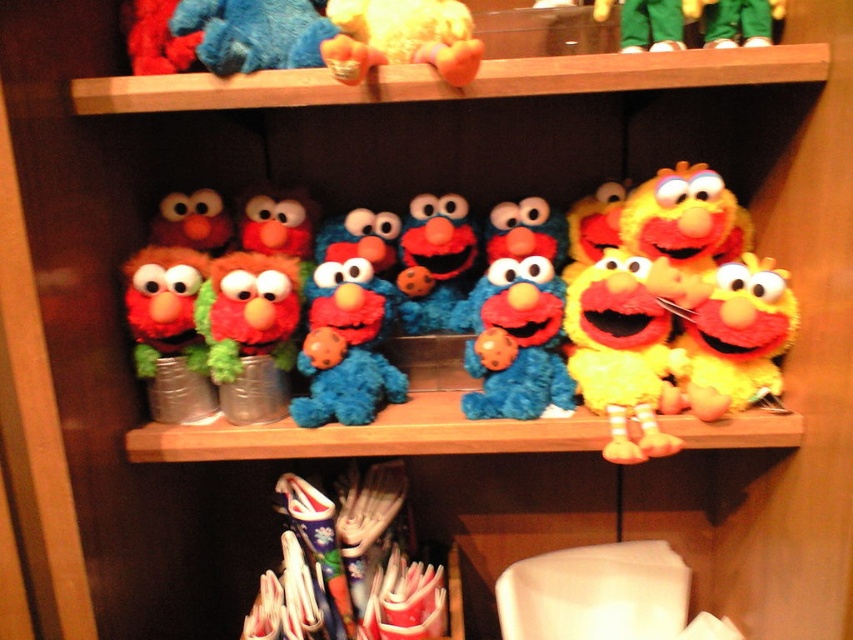
Question: Which of the following is the closest to the observer?

Choices:
 (A) yellow plush toy at center
 (B) velvet plush toy at center
 (C) green plush toy at upper right

Answer: (A)

Question: Which point appears farthest from the camera in this image?

Choices:
 (A) (343, 32)
 (B) (286, 33)
 (C) (763, 368)

Answer: (C)

Question: Does yellow plush toy at right lie behind green plush toy at upper right?

Choices:
 (A) yes
 (B) no

Answer: (B)

Question: Which point is closer to the camera taking this photo?

Choices:
 (A) (616, 355)
 (B) (775, 371)

Answer: (A)

Question: Is yellow plush toy at center positioned behind green plush toy at upper right?

Choices:
 (A) no
 (B) yes

Answer: (A)

Question: Can you confirm if fluffy blue elmo at center is positioned above green plush toy at upper right?

Choices:
 (A) no
 (B) yes

Answer: (A)